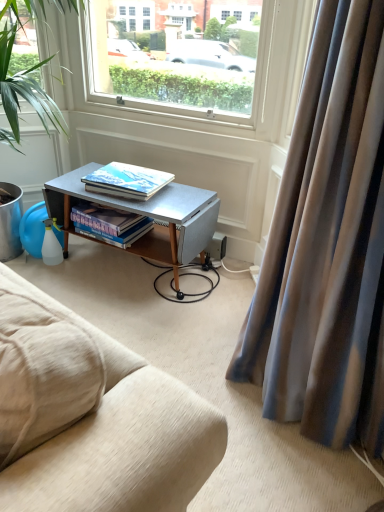
Question: From a real-world perspective, is satin fabric curtain at right beneath green leafy plant at left?

Choices:
 (A) yes
 (B) no

Answer: (B)

Question: Would you say green leafy plant at left is part of satin fabric curtain at right's contents?

Choices:
 (A) no
 (B) yes

Answer: (A)

Question: Is satin fabric curtain at right to the left of green leafy plant at left from the viewer's perspective?

Choices:
 (A) yes
 (B) no

Answer: (B)

Question: Does satin fabric curtain at right have a greater height compared to green leafy plant at left?

Choices:
 (A) yes
 (B) no

Answer: (A)

Question: Considering the relative sizes of satin fabric curtain at right and green leafy plant at left in the image provided, is satin fabric curtain at right bigger than green leafy plant at left?

Choices:
 (A) no
 (B) yes

Answer: (A)

Question: Visually, is satin fabric curtain at right positioned to the left or to the right of green leafy plant at left?

Choices:
 (A) right
 (B) left

Answer: (A)

Question: In terms of size, does satin fabric curtain at right appear bigger or smaller than green leafy plant at left?

Choices:
 (A) big
 (B) small

Answer: (B)

Question: From the image's perspective, is satin fabric curtain at right above or below green leafy plant at left?

Choices:
 (A) above
 (B) below

Answer: (B)

Question: Is satin fabric curtain at right taller or shorter than green leafy plant at left?

Choices:
 (A) tall
 (B) short

Answer: (A)

Question: From the image's perspective, relative to green leafy plant at left, is metallic gray desk at center above or below?

Choices:
 (A) above
 (B) below

Answer: (B)

Question: In terms of width, does metallic gray desk at center look wider or thinner when compared to green leafy plant at left?

Choices:
 (A) thin
 (B) wide

Answer: (A)

Question: From a real-world perspective, is metallic gray desk at center physically located above or below green leafy plant at left?

Choices:
 (A) below
 (B) above

Answer: (A)

Question: Would you say metallic gray desk at center is inside or outside green leafy plant at left?

Choices:
 (A) inside
 (B) outside

Answer: (B)

Question: Looking at the image, does matte hardcover book at center, placed as the first book when sorted from top to bottom, seem bigger or smaller compared to metallic gray desk at center?

Choices:
 (A) small
 (B) big

Answer: (A)

Question: Looking at their shapes, would you say matte hardcover book at center, the 2th book from the bottom, is wider or thinner than metallic gray desk at center?

Choices:
 (A) thin
 (B) wide

Answer: (A)